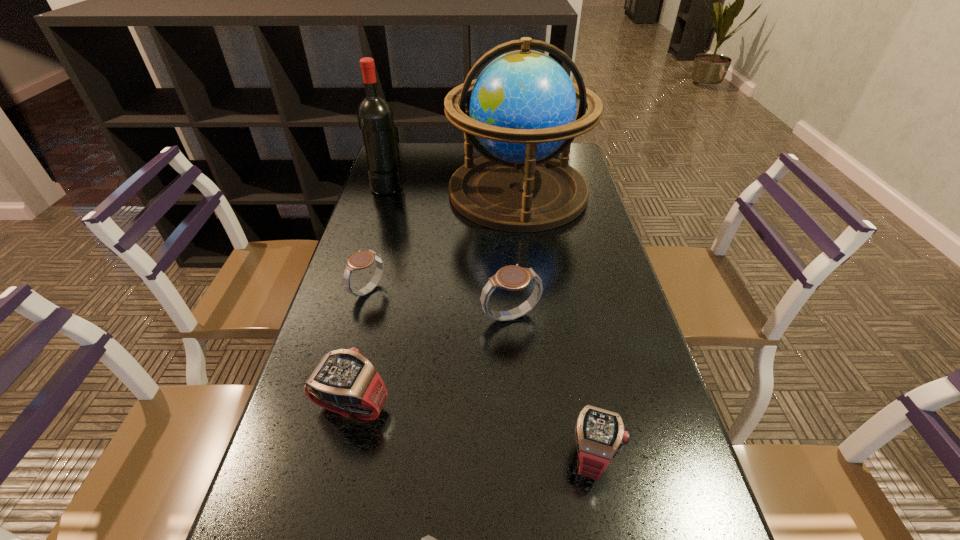
Identify the location of globe. The width and height of the screenshot is (960, 540). (522, 107).

This screenshot has height=540, width=960. I want to click on wine bottle, so click(x=375, y=116).

At what (x,y) coordinates should I click in order to perform the action: click on the rightmost gray watch. Please return your answer as a coordinate pair (x, y). The width and height of the screenshot is (960, 540). Looking at the image, I should click on (513, 278).

Find the location of a particular element. The image size is (960, 540). the biggest gray watch is located at coordinates (513, 278).

Locate an element on the screen. Image resolution: width=960 pixels, height=540 pixels. the bigger red watch is located at coordinates (345, 381).

Locate an element on the screen. The image size is (960, 540). the second smallest gray watch is located at coordinates (360, 260).

The height and width of the screenshot is (540, 960). I want to click on the right red watch, so (x=600, y=434).

Locate an element on the screen. The width and height of the screenshot is (960, 540). the rightmost watch is located at coordinates (600, 434).

Image resolution: width=960 pixels, height=540 pixels. I want to click on free space located on the front of the globe, so click(533, 318).

You are a GUI agent. You are given a task and a screenshot of the screen. Output one action in this format:
    pyautogui.click(x=<x>, y=<y>)
    Task: Click on the free space located on the right of the red wine bottle
    Image resolution: width=960 pixels, height=540 pixels.
    Given the screenshot: What is the action you would take?
    pyautogui.click(x=455, y=186)